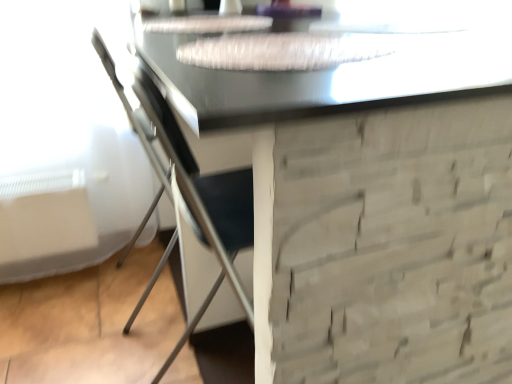
You are a GUI agent. You are given a task and a screenshot of the screen. Output one action in this format:
    pyautogui.click(x=<x>, y=<y>)
    Task: Click on the vacant space positioned to the left of metallic silver swivel chair at center
    
    Given the screenshot: What is the action you would take?
    pyautogui.click(x=66, y=303)